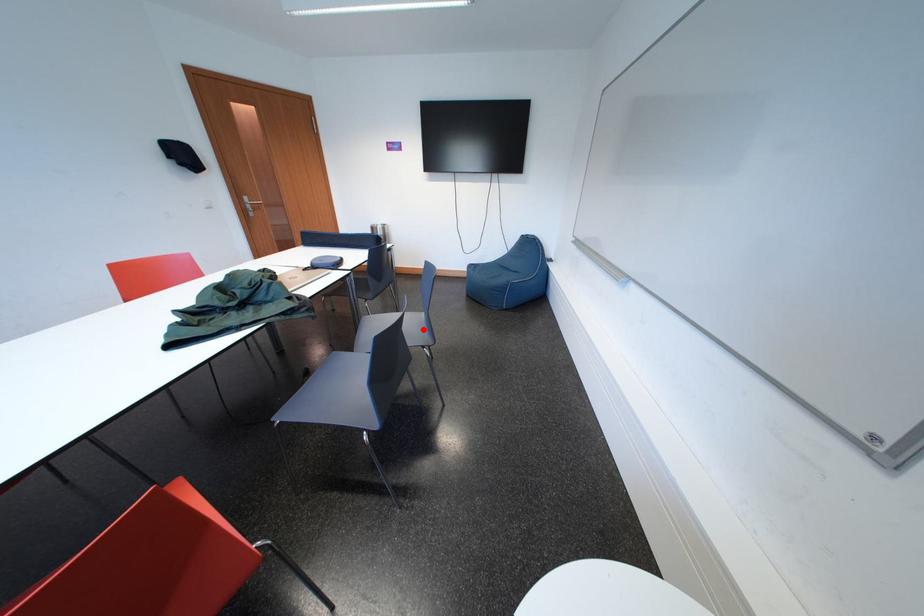
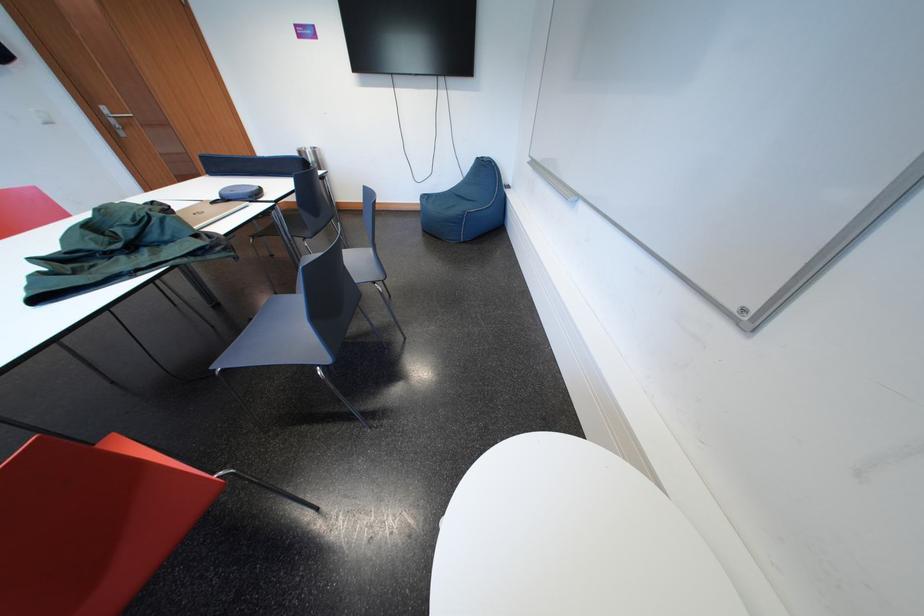
Where in the second image is the point corresponding to the highlighted location from the first image?

(369, 264)